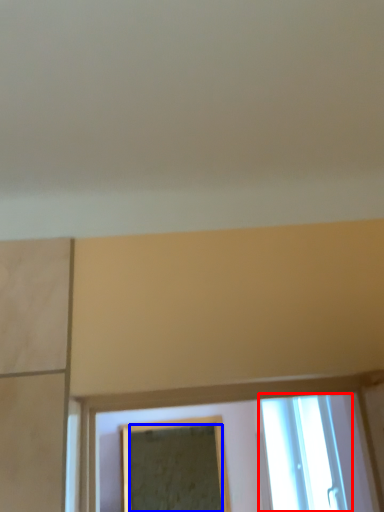
Question: Which object appears closest to the camera in this image, window (highlighted by a red box) or mirror (highlighted by a blue box)?

Choices:
 (A) window
 (B) mirror

Answer: (A)